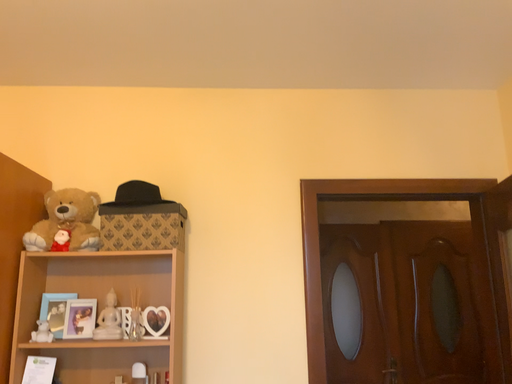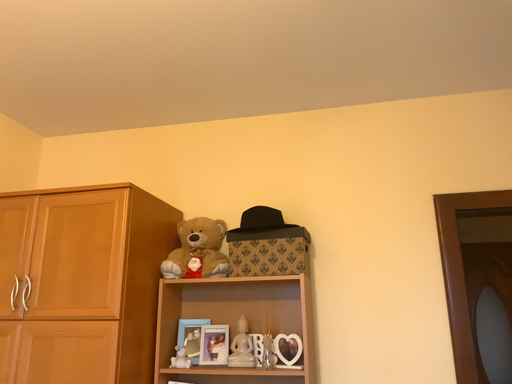
Question: Which way did the camera rotate in the video?

Choices:
 (A) rotated left
 (B) rotated right

Answer: (A)